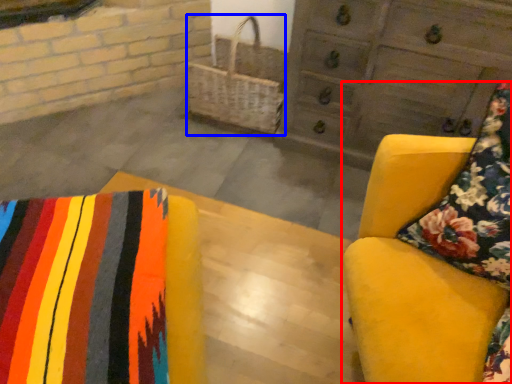
Question: Among these objects, which one is nearest to the camera, furniture (highlighted by a red box) or basket (highlighted by a blue box)?

Choices:
 (A) furniture
 (B) basket

Answer: (A)